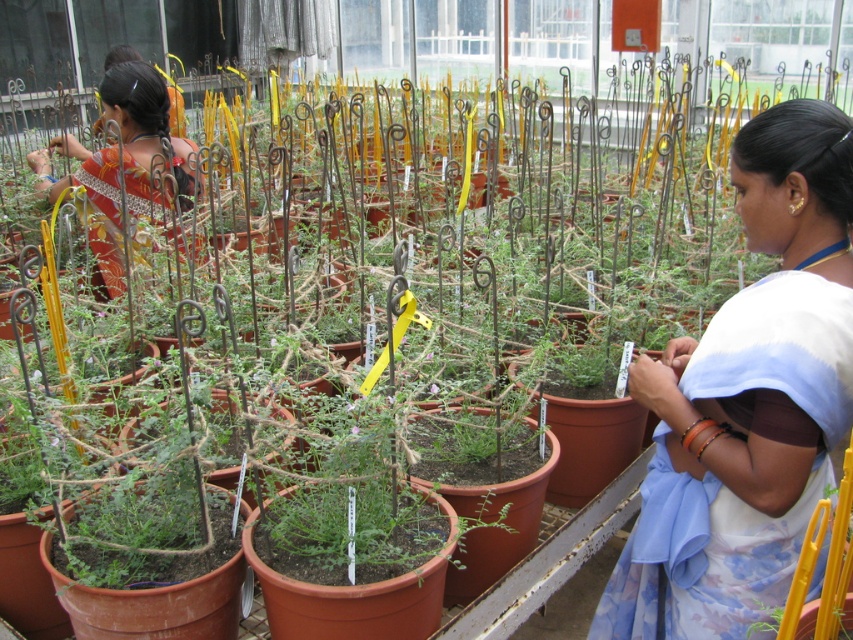
Question: Among these points, which one is farthest from the camera?

Choices:
 (A) (190, 180)
 (B) (801, 304)

Answer: (A)

Question: Where is white cotton saree at center located in relation to matte orange saree at left in the image?

Choices:
 (A) right
 (B) left

Answer: (A)

Question: Which point is closer to the camera?

Choices:
 (A) white cotton saree at center
 (B) matte orange saree at left

Answer: (A)

Question: Does white cotton saree at center have a greater width compared to matte orange saree at left?

Choices:
 (A) yes
 (B) no

Answer: (B)

Question: Can you confirm if white cotton saree at center is positioned above matte orange saree at left?

Choices:
 (A) no
 (B) yes

Answer: (A)